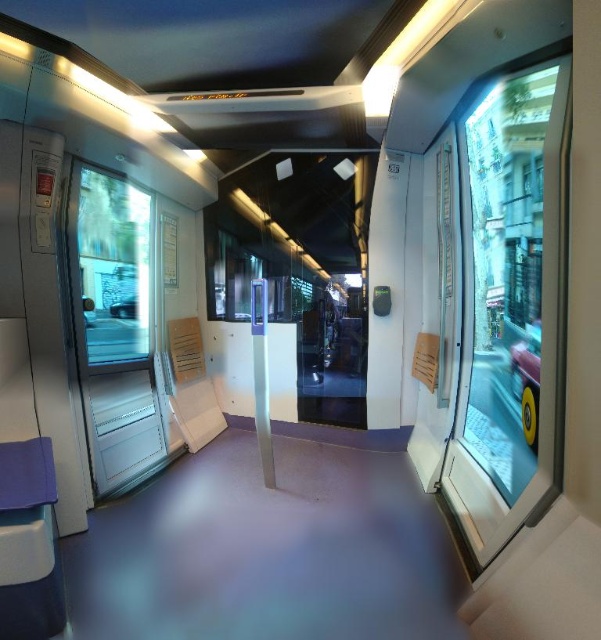
Question: Does transparent glass window at right appear over transparent glass window at left?

Choices:
 (A) yes
 (B) no

Answer: (B)

Question: Does transparent glass window at right appear on the left side of transparent glass window at left?

Choices:
 (A) no
 (B) yes

Answer: (A)

Question: Which of the following is the closest to the observer?

Choices:
 (A) transparent glass window at right
 (B) transparent glass window at left

Answer: (A)

Question: Which point is farther to the camera?

Choices:
 (A) (82, 266)
 (B) (460, 125)

Answer: (B)

Question: Which point is closer to the camera?

Choices:
 (A) transparent glass window at right
 (B) transparent glass window at left

Answer: (A)

Question: Does transparent glass window at right have a lesser width compared to transparent glass window at left?

Choices:
 (A) no
 (B) yes

Answer: (A)